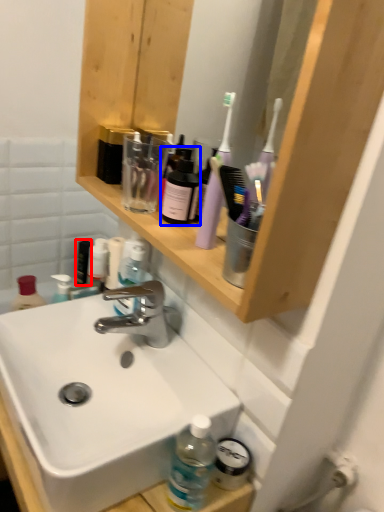
Question: Which point is further to the camera, toiletry (highlighted by a red box) or mouthwash (highlighted by a blue box)?

Choices:
 (A) toiletry
 (B) mouthwash

Answer: (A)